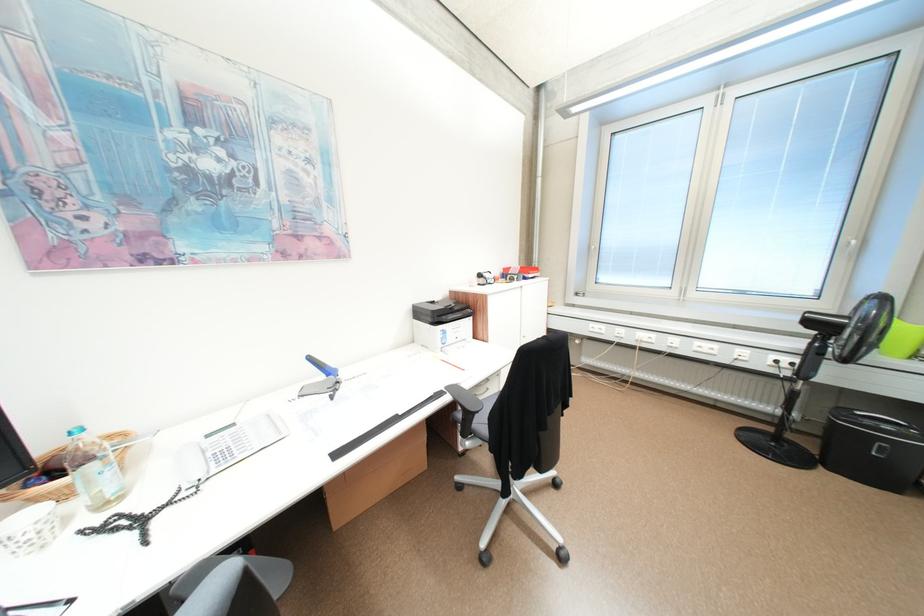
Where would you lift the patterned white cup? Please return your answer as a coordinate pair (x, y).

(30, 530)